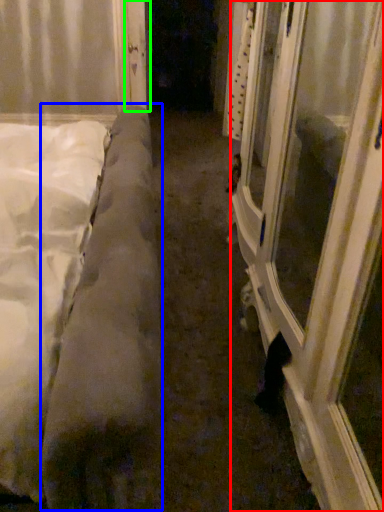
Question: Estimate the real-world distances between objects in this image. Which object is closer to window frame (highlighted by a red box), mattress (highlighted by a blue box) or door (highlighted by a green box)?

Choices:
 (A) mattress
 (B) door

Answer: (A)